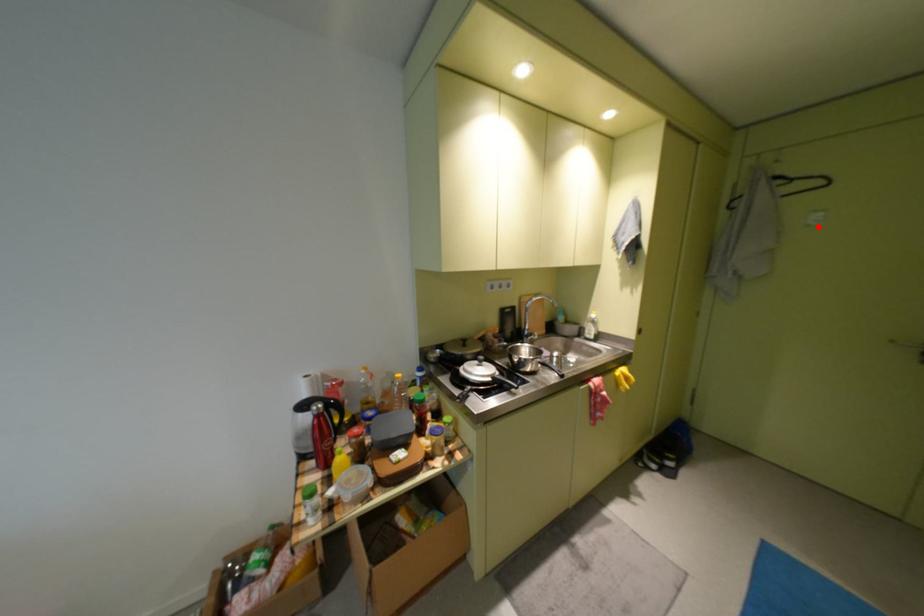
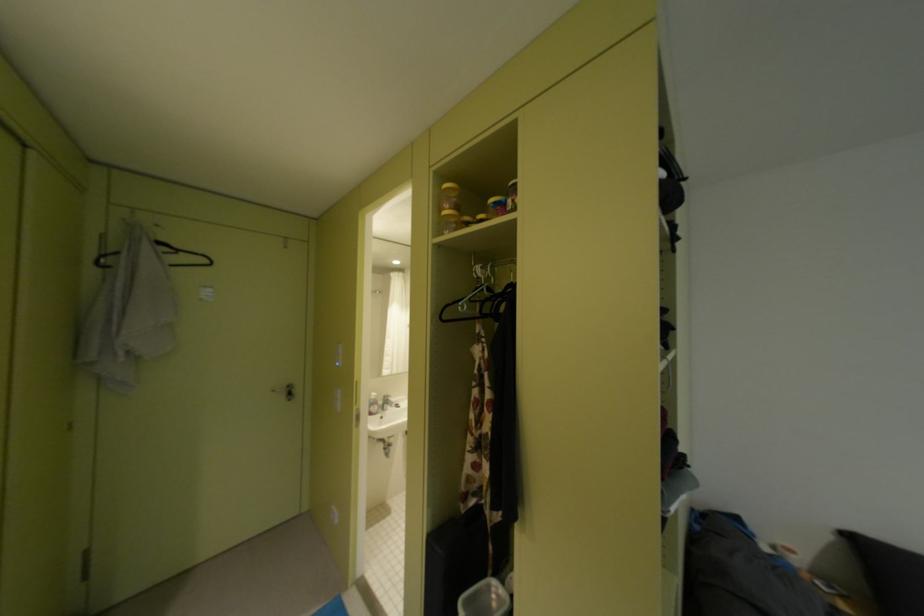
The point at the highlighted location is marked in the first image. Where is the corresponding point in the second image?

(212, 301)